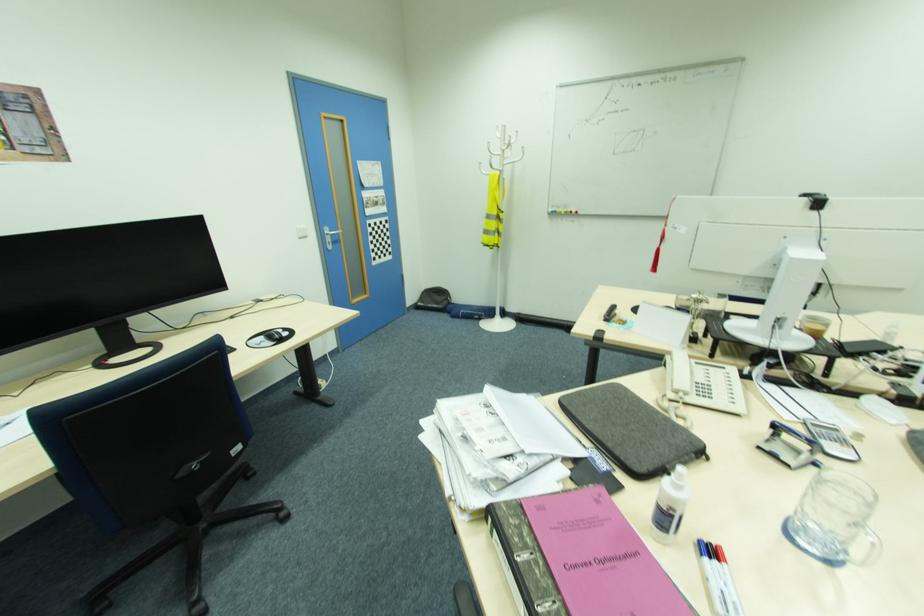
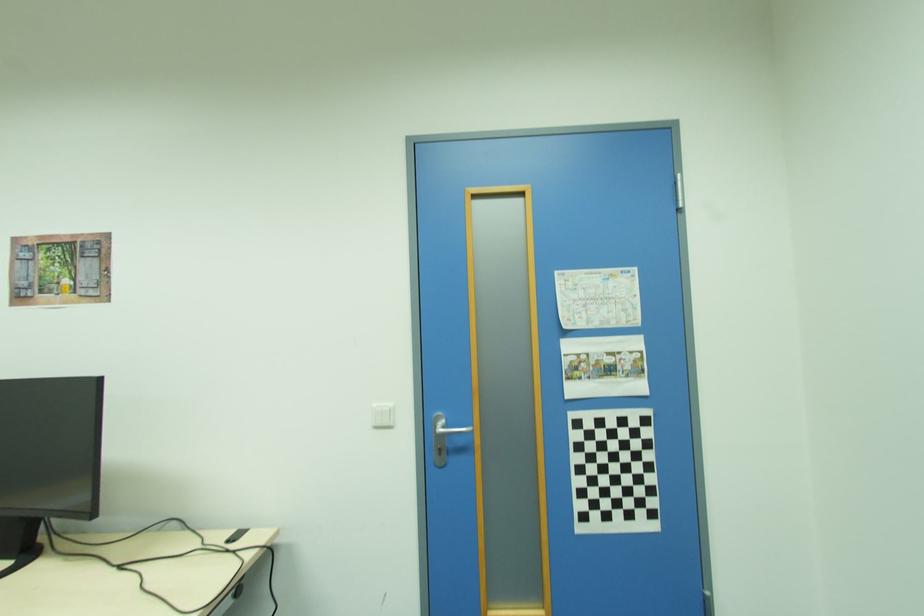
The point at (393, 253) is marked in the first image. Where is the corresponding point in the second image?

(655, 515)